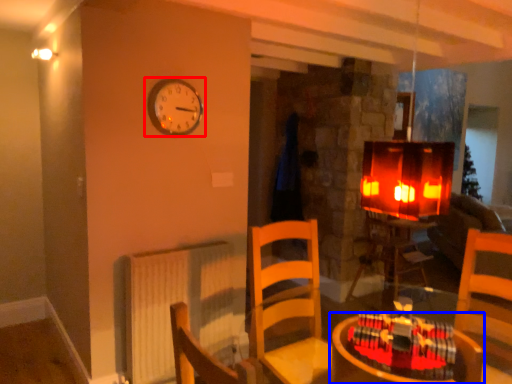
Question: Which object is closer to the camera taking this photo, wall clock (highlighted by a red box) or table (highlighted by a blue box)?

Choices:
 (A) wall clock
 (B) table

Answer: (B)